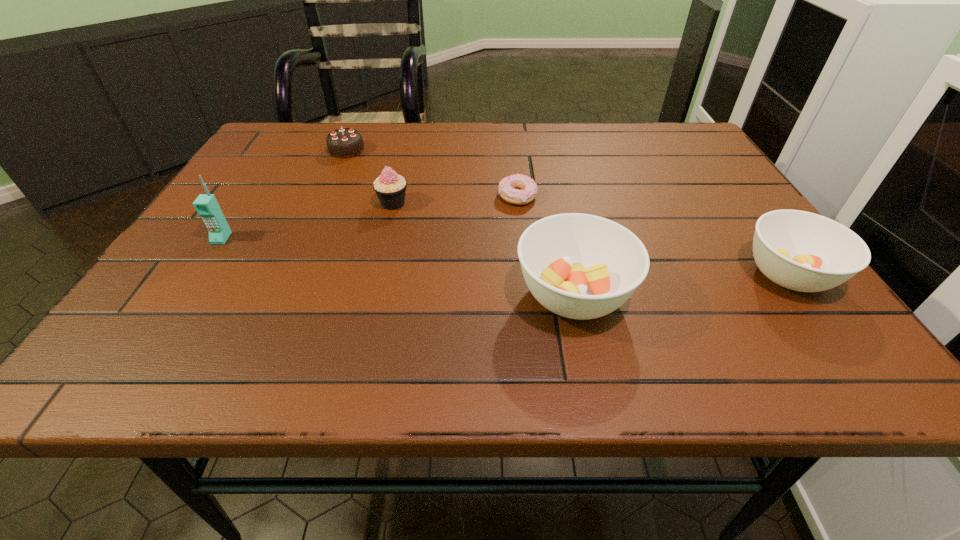
In order to click on vacant region located 0.220m on the left of the rightmost object in this screenshot , I will do `click(623, 274)`.

Find the location of a particular element. This screenshot has width=960, height=540. vacant space located 0.390m on the front of the farthest object is located at coordinates (298, 261).

This screenshot has width=960, height=540. I want to click on free space located on the keypad of the leftmost object, so click(166, 322).

Image resolution: width=960 pixels, height=540 pixels. In order to click on free space located 0.290m on the front of the third object from left to right in this screenshot , I will do `click(366, 313)`.

At what (x,y) coordinates should I click in order to perform the action: click on free region located 0.360m on the right of the doughnut. Please return your answer as a coordinate pair (x, y). Looking at the image, I should click on (695, 196).

At what (x,y) coordinates should I click in order to perform the action: click on object that is positioned at the far edge. Please return your answer as a coordinate pair (x, y). Looking at the image, I should click on (345, 142).

This screenshot has height=540, width=960. In order to click on object that is at the left edge in this screenshot , I will do `click(206, 205)`.

At what (x,y) coordinates should I click in order to perform the action: click on object that is at the right edge. Please return your answer as a coordinate pair (x, y). Image resolution: width=960 pixels, height=540 pixels. Looking at the image, I should click on (798, 250).

Where is `object that is at the near right corner`? This screenshot has width=960, height=540. object that is at the near right corner is located at coordinates (798, 250).

Find the location of a particular element. This screenshot has width=960, height=540. blank area at the far edge is located at coordinates (421, 151).